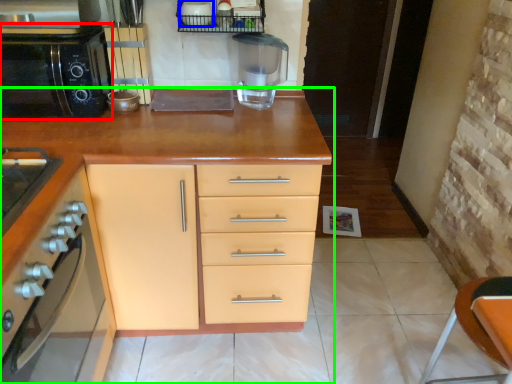
Question: Which object is positioned closest to home appliance (highlighted by a red box)? Select from appliance (highlighted by a blue box) and cabinetry (highlighted by a green box).

Choices:
 (A) appliance
 (B) cabinetry

Answer: (B)